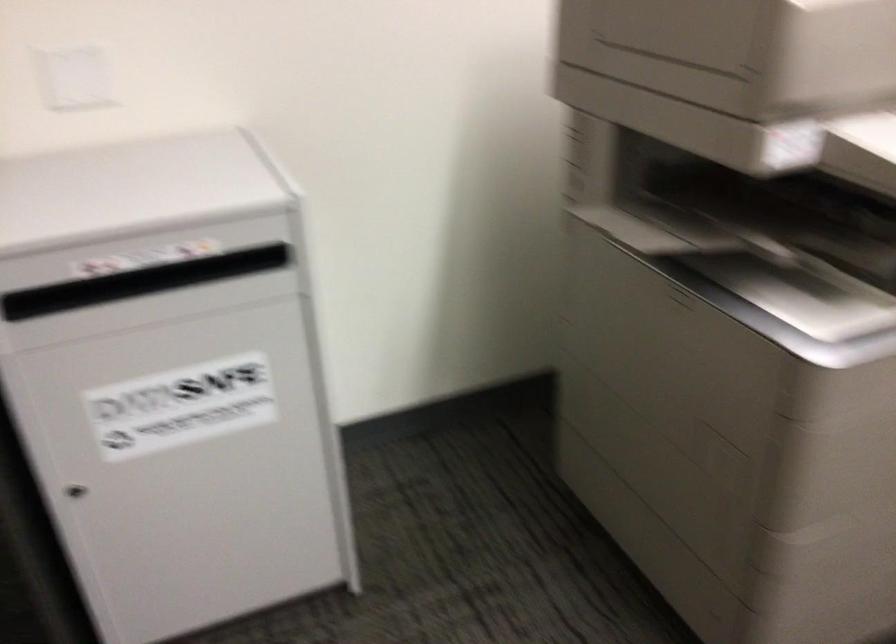
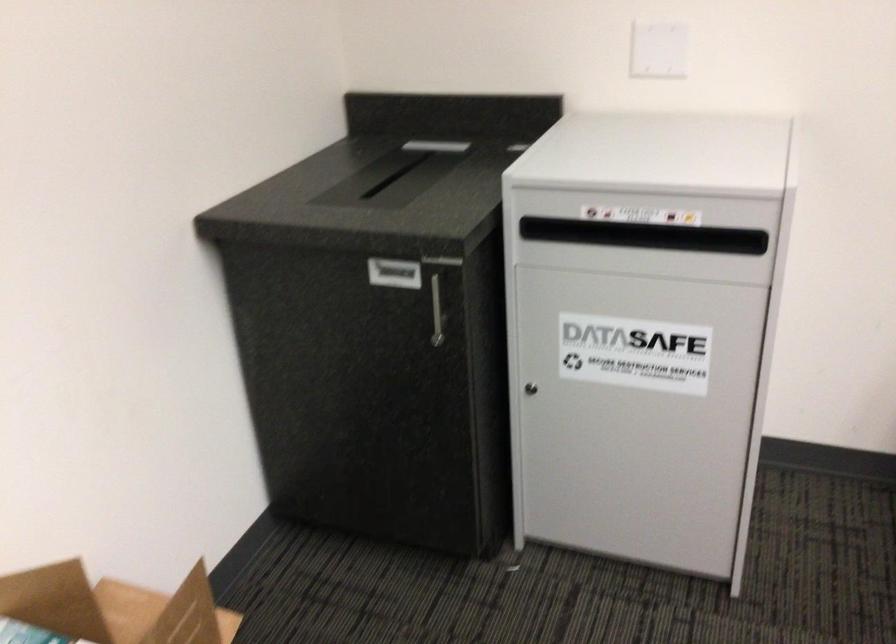
Locate, in the second image, the point that corresponds to pixel 238 257 in the first image.

(746, 241)